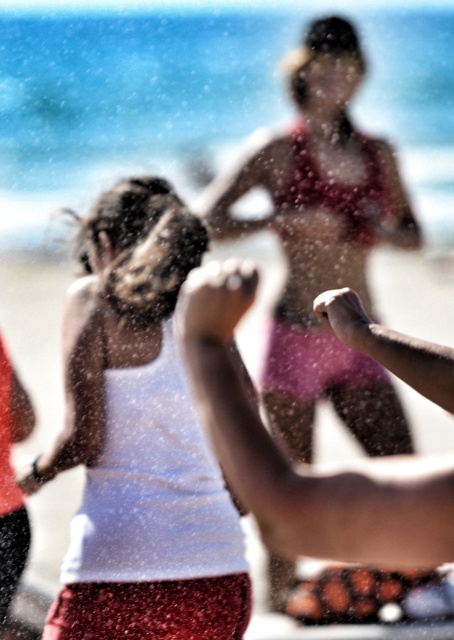
Question: Is clear water at center to the right of white matte tank top at center from the viewer's perspective?

Choices:
 (A) yes
 (B) no

Answer: (B)

Question: Which object is the farthest from the clear water at center?

Choices:
 (A) pink bikini at center
 (B) white matte tank top at center

Answer: (B)

Question: Can you confirm if white matte tank top at center is smaller than pink bikini at center?

Choices:
 (A) yes
 (B) no

Answer: (A)

Question: Does white matte tank top at center appear on the left side of pink bikini at center?

Choices:
 (A) yes
 (B) no

Answer: (A)

Question: Among these objects, which one is nearest to the camera?

Choices:
 (A) pink bikini at center
 (B) clear water at center
 (C) white matte tank top at center

Answer: (C)

Question: Estimate the real-world distances between objects in this image. Which object is farther from the white matte tank top at center?

Choices:
 (A) clear water at center
 (B) pink bikini at center

Answer: (A)